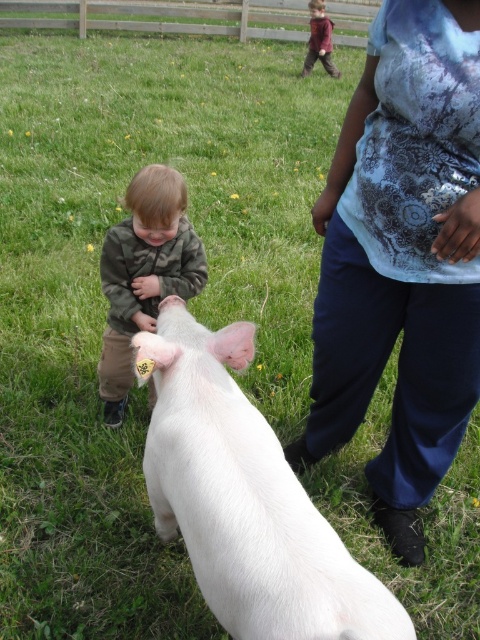
Which is in front, point (408, 445) or point (248, 333)?

Point (248, 333)

Between blue tie-dye shirt at center and white smooth pig at center, which one is positioned lower?

white smooth pig at center is lower down.

Does point (374, 32) come in front of point (222, 500)?

That is False.

The width and height of the screenshot is (480, 640). What are the coordinates of `blue tie-dye shirt at center` in the screenshot? It's located at (402, 259).

Between blue tie-dye shirt at center and camouflage jacket at center, which one is positioned higher?

camouflage jacket at center is above.

Can you confirm if blue tie-dye shirt at center is positioned above camouflage jacket at center?

No, blue tie-dye shirt at center is not above camouflage jacket at center.

Between point (316, 209) and point (115, 266), which one is positioned behind?

The point (115, 266) is more distant.

In order to click on blue tie-dye shirt at center in this screenshot , I will do `click(402, 259)`.

Who is positioned more to the left, white smooth pig at center or camouflage jacket at center?

From the viewer's perspective, camouflage jacket at center appears more on the left side.

Does white smooth pig at center have a lesser height compared to camouflage jacket at center?

Yes.

Describe the element at coordinates (244, 497) in the screenshot. This screenshot has height=640, width=480. I see `white smooth pig at center` at that location.

This screenshot has width=480, height=640. I want to click on white smooth pig at center, so click(244, 497).